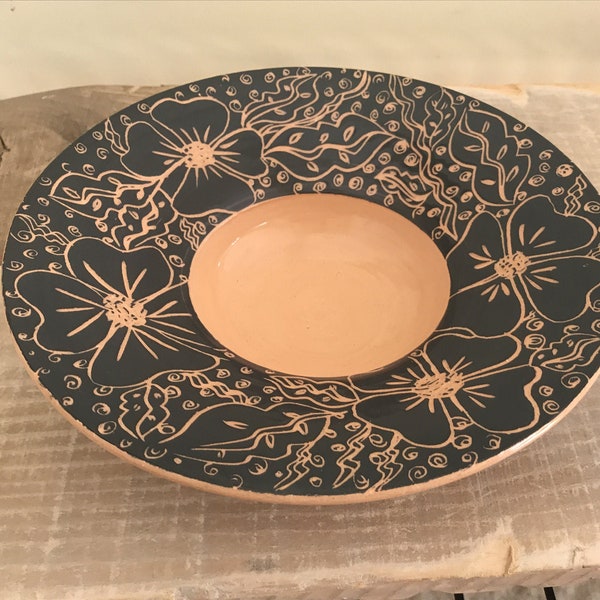
Where is `gold center of plate`? gold center of plate is located at coordinates (348, 301).